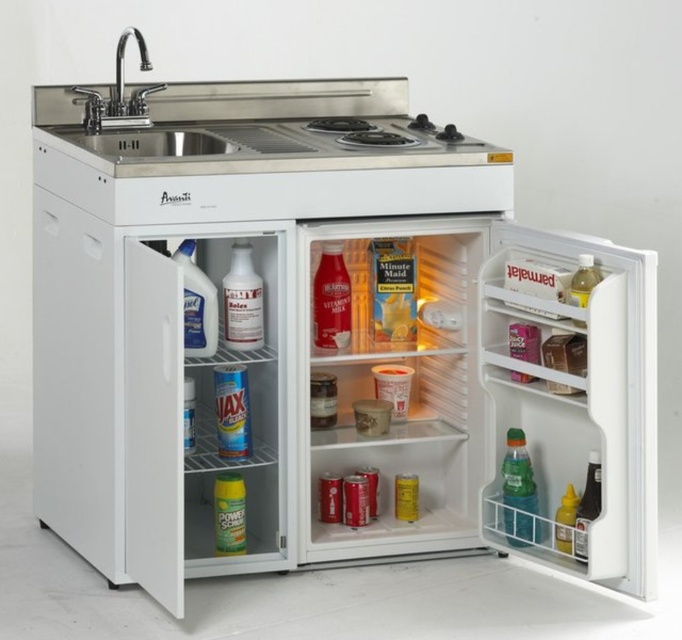
Question: Based on their relative distances, which object is farther from the green translucent bottle at right?

Choices:
 (A) translucent plastic bottle at center
 (B) stainless steel sink at upper left

Answer: (B)

Question: Estimate the real-world distances between objects in this image. Which object is farther from the translucent plastic bottle at lower right?

Choices:
 (A) silver metallic faucet at upper left
 (B) translucent plastic bottle at upper right

Answer: (A)

Question: Which point is farther to the camera?

Choices:
 (A) (578, 296)
 (B) (108, 106)
 (C) (537, 515)
 (D) (93, 140)

Answer: (B)

Question: Does matte plastic bottle at center have a larger size compared to translucent plastic bottle at upper right?

Choices:
 (A) yes
 (B) no

Answer: (A)

Question: Can you confirm if stainless steel sink at upper left is positioned above translucent plastic bottle at upper right?

Choices:
 (A) no
 (B) yes

Answer: (B)

Question: Can you confirm if translucent plastic bottle at center is bigger than clear plastic bottle at left?

Choices:
 (A) no
 (B) yes

Answer: (A)